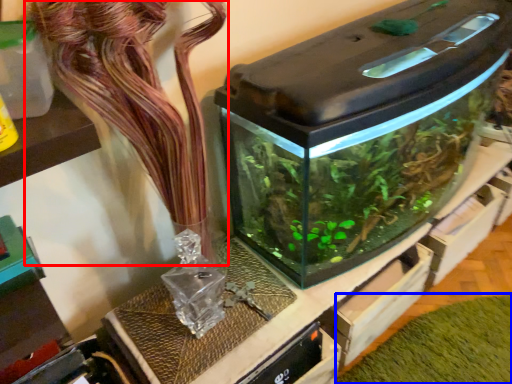
Question: Among these objects, which one is farthest to the camera, flower (highlighted by a red box) or plant (highlighted by a blue box)?

Choices:
 (A) flower
 (B) plant

Answer: (B)